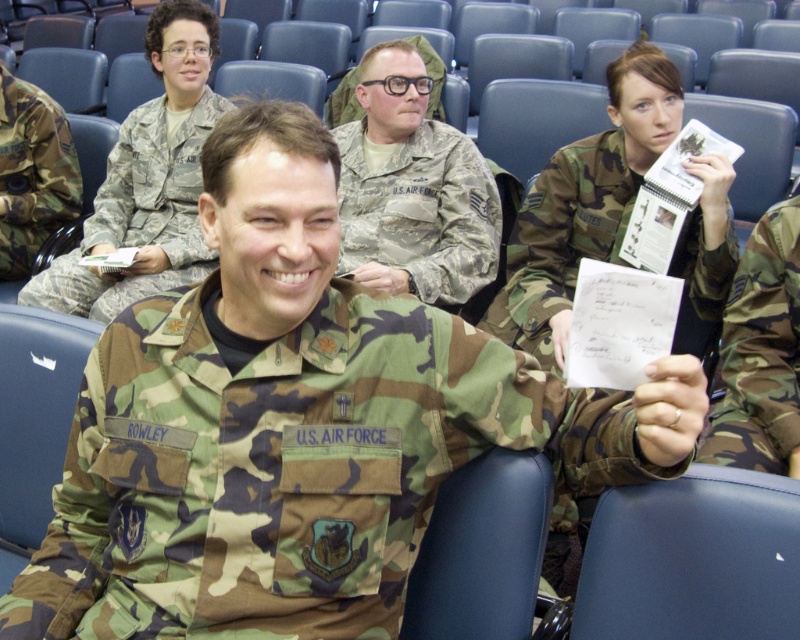
In the image of the auditorium with blue seats and U.S. Air Force personnel, there is a point marked at coordinates (562, 237). What object is located at this coordinate?

The point at coordinates (562, 237) marks the camouflage fabric notebook at upper right.

You are an observer in the auditorium. You notice the camouflage uniform at center and the camouflage fabric notebook at upper right. Which object is wider?

The camouflage fabric notebook at upper right is wider than the camouflage uniform at center.

You are a military assistant standing in the auditorium and need to hand a document to the person wearing the camouflage fabric uniform at left. The document is 2 meters long. Can you place the document on the camouflage fabric notebook at upper right without it hanging off the edge?

The camouflage fabric notebook at upper right is 1.72 meters away from the camouflage fabric uniform at left. Since the document is 2 meters long, it will hang off the edge by 0.28 meters.